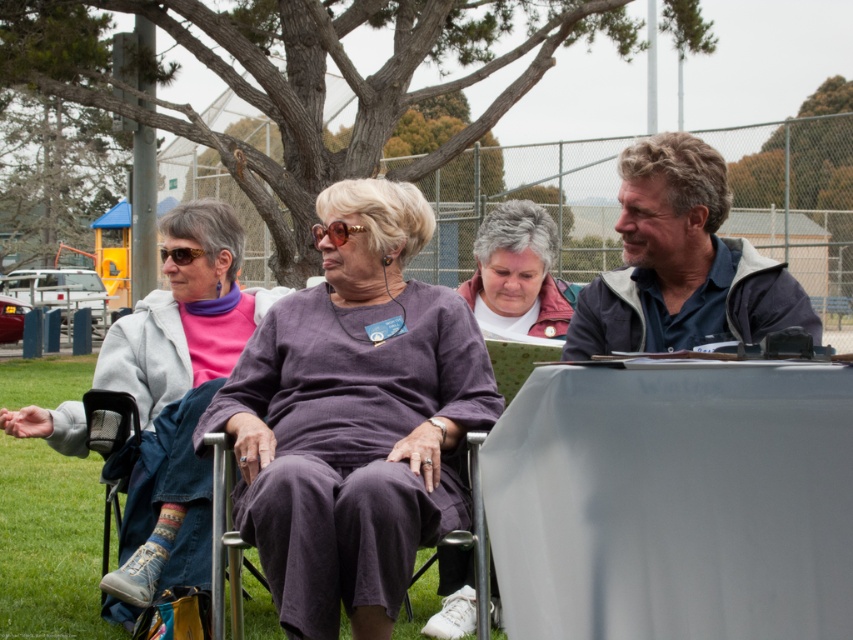
You are an observer looking at the group of people seated on folding chairs. Which jacket, the blue fabric jacket at center or the white matte jacket at center, is positioned higher up?

The blue fabric jacket at center is located above the white matte jacket at center, so it is positioned higher up.

You are planning to hang a small picture frame on the wall behind the matte gray jacket at center and the purple fabric chair at center. Since the wall space is limited, you need to know which object is taller to ensure the frame fits properly. Which one is taller?

The matte gray jacket at center is taller than the purple fabric chair at center, so you should consider its height when hanging the frame to ensure it fits properly.